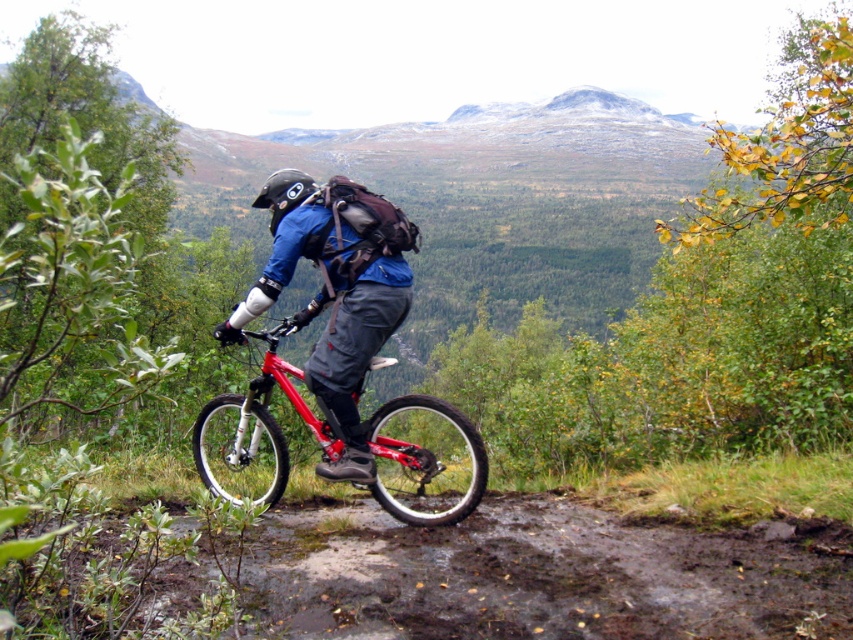
Question: Does brown muddy dirt track at lower center appear on the left side of black matte helmet at center?

Choices:
 (A) yes
 (B) no

Answer: (B)

Question: Which of these objects is positioned farthest from the brown muddy dirt track at lower center?

Choices:
 (A) black matte helmet at center
 (B) shiny red frame at center
 (C) matte blue jacket at center

Answer: (A)

Question: Can you confirm if brown muddy dirt track at lower center is smaller than matte blue jacket at center?

Choices:
 (A) yes
 (B) no

Answer: (B)

Question: Which of the following is the closest to the observer?

Choices:
 (A) matte blue jacket at center
 (B) shiny red frame at center
 (C) brown muddy dirt track at lower center
 (D) black matte helmet at center

Answer: (C)

Question: Is brown muddy dirt track at lower center to the right of black matte helmet at center from the viewer's perspective?

Choices:
 (A) no
 (B) yes

Answer: (B)

Question: Which object is farther from the camera taking this photo?

Choices:
 (A) black matte helmet at center
 (B) brown muddy dirt track at lower center
 (C) shiny red frame at center
 (D) matte blue jacket at center

Answer: (A)